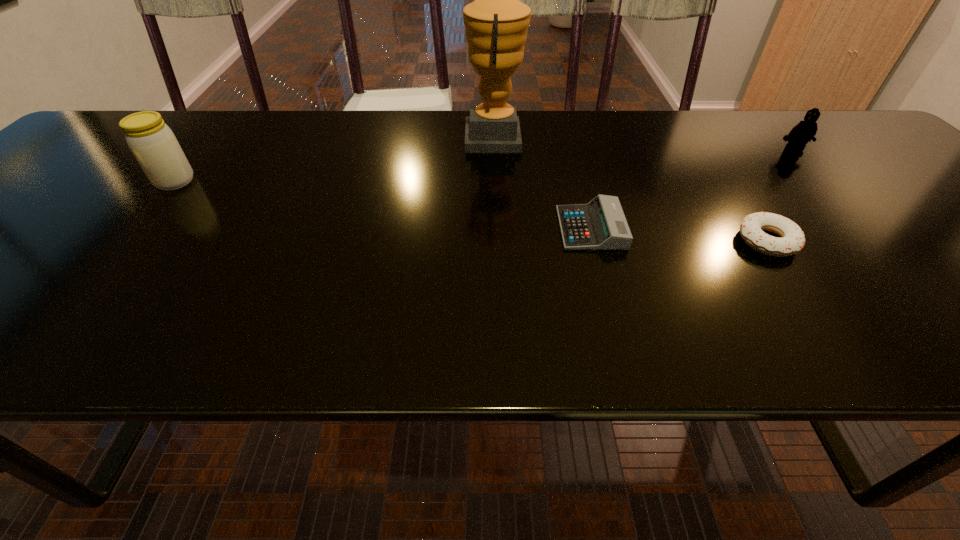
In the image, there is a desktop. Where is `vacant space at the far right corner`? This screenshot has width=960, height=540. vacant space at the far right corner is located at coordinates (823, 124).

Where is `vacant area that lies between the rightmost object and the second object from left to right`? The width and height of the screenshot is (960, 540). vacant area that lies between the rightmost object and the second object from left to right is located at coordinates click(643, 145).

Find the location of a particular element. This screenshot has height=540, width=960. blank region between the fourth object from left to right and the jar is located at coordinates (471, 211).

In order to click on free space between the doughnut and the third farthest object in this screenshot , I will do `click(471, 211)`.

The image size is (960, 540). I want to click on empty space between the third farthest object and the third shortest object, so click(x=484, y=167).

Identify the location of vacant area that lies between the calculator and the third nearest object. (383, 205).

Where is `free space between the third object from left to right and the award`? This screenshot has width=960, height=540. free space between the third object from left to right and the award is located at coordinates (542, 183).

The height and width of the screenshot is (540, 960). Find the location of `free spot between the calculator and the jar`. free spot between the calculator and the jar is located at coordinates (383, 205).

The image size is (960, 540). What are the coordinates of `vacant space in between the calculator and the third shortest object` in the screenshot? It's located at (691, 191).

I want to click on vacant area between the third nearest object and the fourth object from right to left, so click(334, 159).